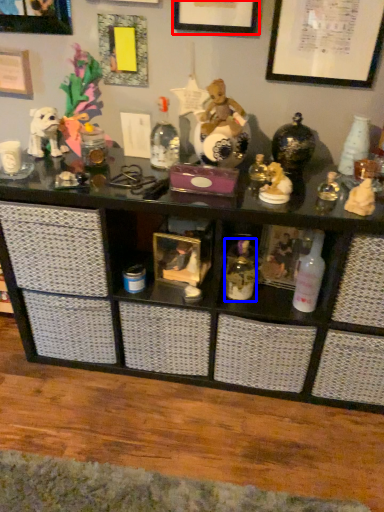
Question: Which of the following is the farthest to the observer, picture frame (highlighted by a red box) or toiletry (highlighted by a blue box)?

Choices:
 (A) picture frame
 (B) toiletry

Answer: (B)